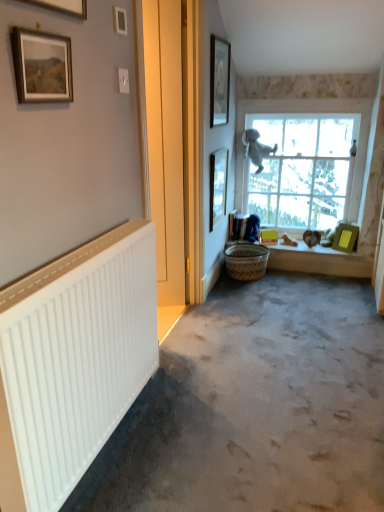
Question: Is matte gold picture frame at upper left, the 6th picture frame when ordered from right to left, positioned with its back to matte black picture frame at right, which is the 5th picture frame from left to right?

Choices:
 (A) no
 (B) yes

Answer: (A)

Question: Is matte gold picture frame at upper left, the 6th picture frame viewed from the back, far away from matte black picture frame at right, which appears as the 2th picture frame when viewed from the right?

Choices:
 (A) no
 (B) yes

Answer: (B)

Question: Is matte gold picture frame at upper left, marked as the first picture frame in a front-to-back arrangement, oriented towards matte black picture frame at right, positioned as the 2th picture frame in back-to-front order?

Choices:
 (A) no
 (B) yes

Answer: (A)

Question: Considering the relative positions of matte gold picture frame at upper left, the 6th picture frame viewed from the back, and matte black picture frame at right, the 5th picture frame positioned from the front, in the image provided, is matte gold picture frame at upper left, the 6th picture frame viewed from the back, to the left of matte black picture frame at right, the 5th picture frame positioned from the front, from the viewer's perspective?

Choices:
 (A) no
 (B) yes

Answer: (B)

Question: Considering the relative sizes of matte gold picture frame at upper left, which ranks as the 1th picture frame in left-to-right order, and matte black picture frame at right, which is the 5th picture frame from left to right, in the image provided, is matte gold picture frame at upper left, which ranks as the 1th picture frame in left-to-right order, taller than matte black picture frame at right, which is the 5th picture frame from left to right,?

Choices:
 (A) no
 (B) yes

Answer: (A)

Question: Is green matte picture frame at right, which ranks as the first picture frame in right-to-left order, situated inside woven brown basket at lower center or outside?

Choices:
 (A) outside
 (B) inside

Answer: (A)

Question: Is point (342, 248) closer or farther from the camera than point (264, 269)?

Choices:
 (A) closer
 (B) farther

Answer: (A)

Question: Visually, is green matte picture frame at right, positioned as the 1th picture frame in back-to-front order, positioned to the left or to the right of woven brown basket at lower center?

Choices:
 (A) right
 (B) left

Answer: (A)

Question: From a real-world perspective, is green matte picture frame at right, positioned as the 1th picture frame in back-to-front order, physically located above or below woven brown basket at lower center?

Choices:
 (A) below
 (B) above

Answer: (B)

Question: Is white matte radiator at left bigger or smaller than clear glass window at upper right?

Choices:
 (A) small
 (B) big

Answer: (B)

Question: Is point (127, 499) closer or farther from the camera than point (264, 184)?

Choices:
 (A) farther
 (B) closer

Answer: (B)

Question: Is white matte radiator at left spatially inside clear glass window at upper right, or outside of it?

Choices:
 (A) outside
 (B) inside

Answer: (A)

Question: Visually, is white matte radiator at left positioned to the left or to the right of clear glass window at upper right?

Choices:
 (A) right
 (B) left

Answer: (B)

Question: From a real-world perspective, relative to green matte picture frame at right, marked as the sixth picture frame in a left-to-right arrangement, is matte gold picture frame at upper left, marked as the first picture frame in a front-to-back arrangement, vertically above or below?

Choices:
 (A) below
 (B) above

Answer: (B)

Question: Is point (77, 14) closer or farther from the camera than point (344, 227)?

Choices:
 (A) farther
 (B) closer

Answer: (B)